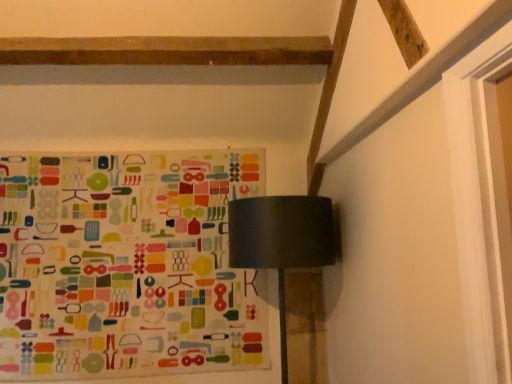
Question: In terms of size, does matte black lampshade at upper center appear bigger or smaller than multicolored fabric bulletin board at upper center?

Choices:
 (A) big
 (B) small

Answer: (A)

Question: Considering the positions of point (276, 216) and point (84, 354), is point (276, 216) closer or farther from the camera than point (84, 354)?

Choices:
 (A) farther
 (B) closer

Answer: (B)

Question: Considering the relative positions of matte black lampshade at upper center and multicolored fabric bulletin board at upper center in the image provided, is matte black lampshade at upper center to the left or to the right of multicolored fabric bulletin board at upper center?

Choices:
 (A) left
 (B) right

Answer: (B)

Question: In terms of height, does multicolored fabric bulletin board at upper center look taller or shorter compared to matte black lampshade at upper center?

Choices:
 (A) tall
 (B) short

Answer: (A)

Question: Based on their sizes in the image, would you say multicolored fabric bulletin board at upper center is bigger or smaller than matte black lampshade at upper center?

Choices:
 (A) big
 (B) small

Answer: (B)

Question: In the image, is multicolored fabric bulletin board at upper center positioned in front of or behind matte black lampshade at upper center?

Choices:
 (A) behind
 (B) front

Answer: (A)

Question: From a real-world perspective, is multicolored fabric bulletin board at upper center positioned above or below matte black lampshade at upper center?

Choices:
 (A) below
 (B) above

Answer: (B)